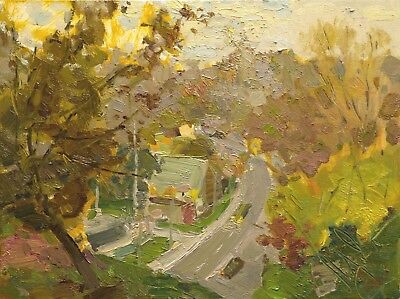
Locate an element on the screen. chimney is located at coordinates (210, 181).